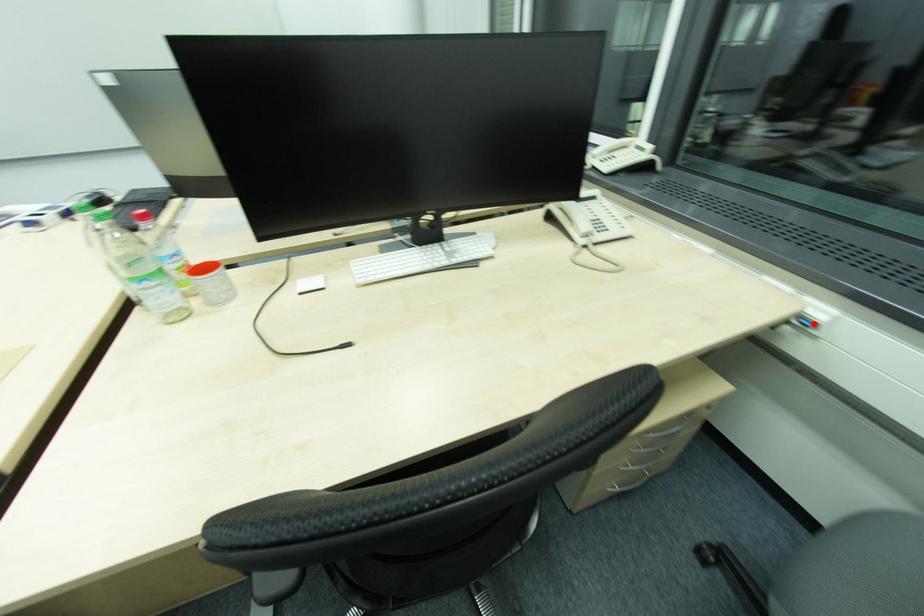
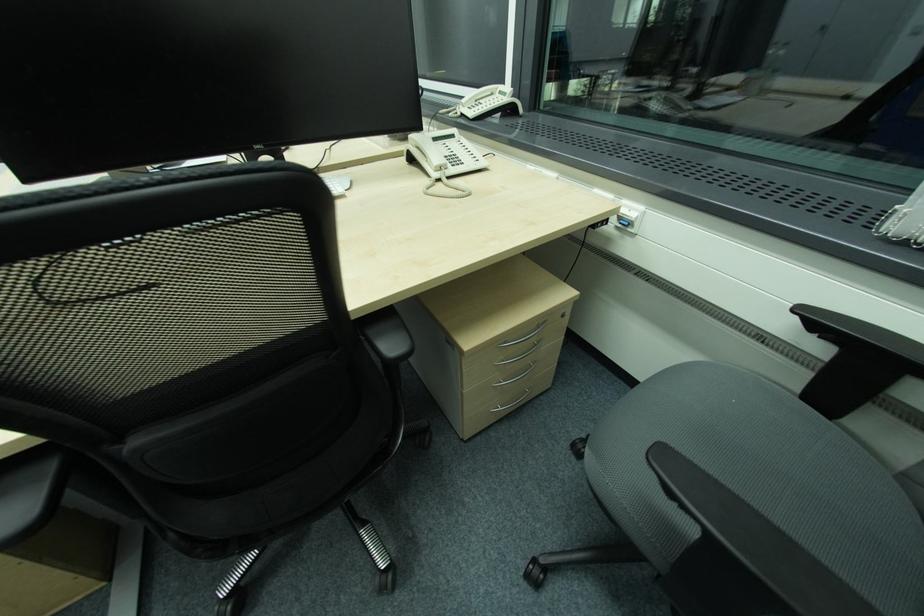
Find the pixel in the second image that matches the highlighted location in the first image.

(631, 225)